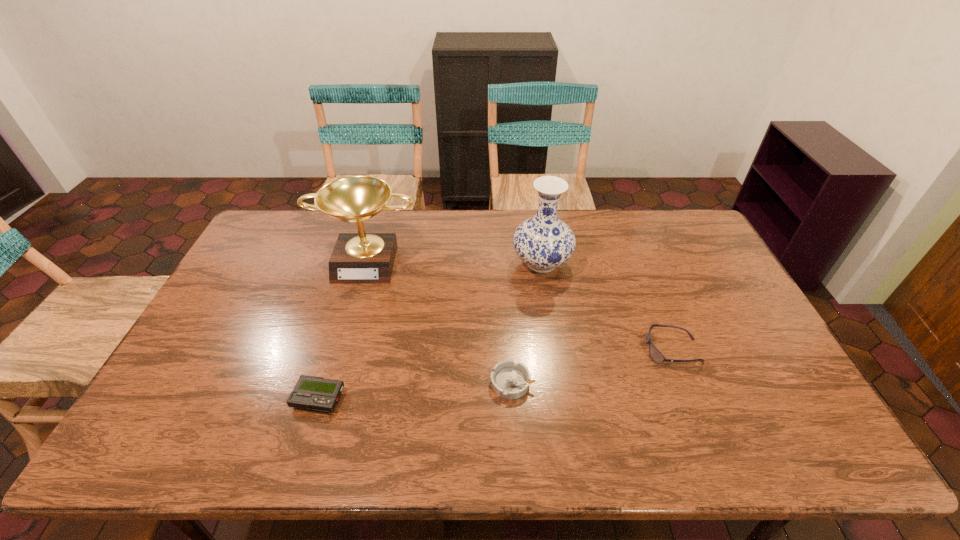
Where is `free space located 0.380m on the lenses of the sunglasses`? The height and width of the screenshot is (540, 960). free space located 0.380m on the lenses of the sunglasses is located at coordinates (509, 350).

Where is `blank space located 0.080m on the front of the beeper`? The image size is (960, 540). blank space located 0.080m on the front of the beeper is located at coordinates (304, 447).

Image resolution: width=960 pixels, height=540 pixels. Identify the location of free space located 0.270m on the left of the ashtray. (386, 383).

The width and height of the screenshot is (960, 540). In order to click on vase located in the far edge section of the desktop in this screenshot , I will do `click(543, 242)`.

The image size is (960, 540). Identify the location of award located at the far edge. (358, 258).

Where is `vacant space at the far edge`? vacant space at the far edge is located at coordinates (652, 245).

In the image, there is a desktop. What are the coordinates of `vacant space at the near edge` in the screenshot? It's located at (686, 453).

Find the location of a particular element. vacant region at the left edge of the desktop is located at coordinates (177, 421).

You are a GUI agent. You are given a task and a screenshot of the screen. Output one action in this format:
    pyautogui.click(x=<x>, y=<y>)
    Task: Click on the free spot at the right edge of the desktop
    The height and width of the screenshot is (540, 960).
    Given the screenshot: What is the action you would take?
    pyautogui.click(x=685, y=264)

The image size is (960, 540). In order to click on free space at the far left corner of the desktop in this screenshot , I will do `click(296, 227)`.